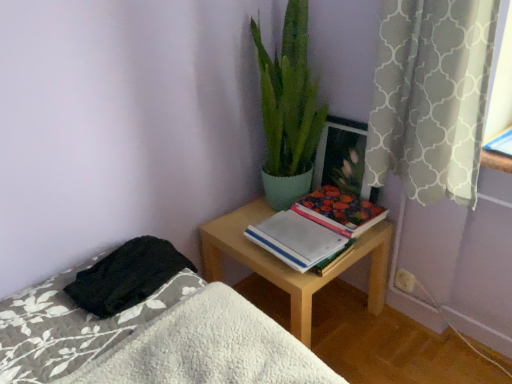
You are a GUI agent. You are given a task and a screenshot of the screen. Output one action in this format:
    pyautogui.click(x=<x>, y=<y>)
    Task: Click on the free point above wooden picture frame at upper right (from a real-world perspective)
    This screenshot has width=512, height=384.
    Given the screenshot: What is the action you would take?
    [337, 118]